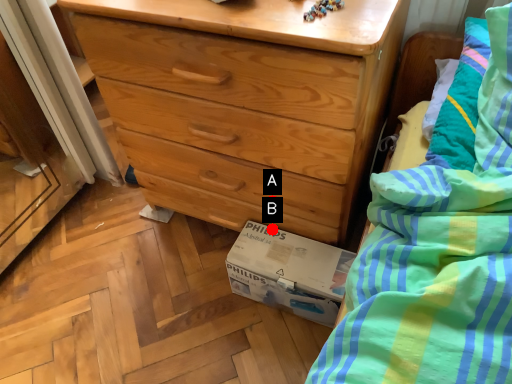
Question: Two points are circled on the image, labeled by A and B beside each circle. Which point appears farthest from the camera in this image?

Choices:
 (A) A is further
 (B) B is further

Answer: (B)